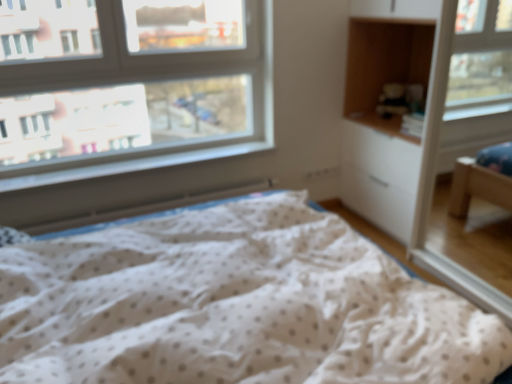
Measure the distance between point (x=2, y=320) and camera.

Point (x=2, y=320) and camera are 1.24 meters apart.

Locate an element on the screen. white plastic radiator at lower left is located at coordinates (141, 210).

Describe the element at coordinates (133, 82) in the screenshot. The image size is (512, 384). I see `clear glass window at upper left` at that location.

Describe the element at coordinates (132, 165) in the screenshot. The image size is (512, 384). I see `white plastic window sill at lower left` at that location.

The width and height of the screenshot is (512, 384). In order to click on wooden cabinet at upper right in this screenshot , I will do `click(384, 67)`.

Is white plastic radiator at lower left smaller than clear glass window at upper left?

Yes.

Considering the sizes of objects white plastic radiator at lower left and clear glass window at upper left in the image provided, who is thinner, white plastic radiator at lower left or clear glass window at upper left?

clear glass window at upper left is thinner.

Would you say white plastic radiator at lower left is a long distance from clear glass window at upper left?

They are positioned close to each other.

From a real-world perspective, which is physically above, white plastic radiator at lower left or clear glass window at upper left?

clear glass window at upper left, from a real-world perspective.

Can you confirm if wooden cabinet at upper right is taller than clear glass window at upper left?

Incorrect, the height of wooden cabinet at upper right is not larger of that of clear glass window at upper left.

What's the angular difference between wooden cabinet at upper right and clear glass window at upper left's facing directions?

The angle between the facing direction of wooden cabinet at upper right and the facing direction of clear glass window at upper left is 90.9 degrees.

This screenshot has width=512, height=384. I want to click on window that appears below the wooden cabinet at upper right (from the image's perspective), so click(133, 82).

Identify the location of window sill on the left of white plastic radiator at lower left. The width and height of the screenshot is (512, 384). (132, 165).

Do you think white plastic window sill at lower left is within white plastic radiator at lower left, or outside of it?

white plastic window sill at lower left is not inside white plastic radiator at lower left, it's outside.

Can you confirm if white plastic window sill at lower left is wider than white plastic radiator at lower left?

Yes, white plastic window sill at lower left is wider than white plastic radiator at lower left.

Consider the image. How many degrees apart are the facing directions of white plastic window sill at lower left and white plastic radiator at lower left?

The angular difference between white plastic window sill at lower left and white plastic radiator at lower left is 0.729 degrees.

Is white dotted fabric at center positioned in front of wooden cabinet at upper right?

Yes.

Considering the sizes of objects white dotted fabric at center and wooden cabinet at upper right in the image provided, who is wider, white dotted fabric at center or wooden cabinet at upper right?

white dotted fabric at center is wider.

The width and height of the screenshot is (512, 384). I want to click on bed in front of the wooden cabinet at upper right, so click(234, 306).

Consider the image. Are white dotted fabric at center and wooden cabinet at upper right far apart?

Absolutely, white dotted fabric at center is distant from wooden cabinet at upper right.

Is white plastic radiator at lower left aimed at white plastic window sill at lower left?

No.

Does point (177, 198) lie in front of point (81, 172)?

No, (177, 198) is behind (81, 172).

Can you confirm if white plastic radiator at lower left is smaller than white plastic window sill at lower left?

Incorrect, white plastic radiator at lower left is not smaller in size than white plastic window sill at lower left.

Does clear glass window at upper left turn towards wooden cabinet at upper right?

No, clear glass window at upper left is not facing towards wooden cabinet at upper right.

Choose the correct answer: Is clear glass window at upper left inside wooden cabinet at upper right or outside it?

clear glass window at upper left lies outside wooden cabinet at upper right.

Between clear glass window at upper left and wooden cabinet at upper right, which one appears on the left side from the viewer's perspective?

From the viewer's perspective, clear glass window at upper left appears more on the left side.

Is clear glass window at upper left not near wooden cabinet at upper right?

They are positioned close to each other.

Is white plastic window sill at lower left inside or outside of wooden cabinet at upper right?

white plastic window sill at lower left exists outside the volume of wooden cabinet at upper right.

The width and height of the screenshot is (512, 384). I want to click on window sill on the left of wooden cabinet at upper right, so click(x=132, y=165).

Considering the relative sizes of white plastic window sill at lower left and wooden cabinet at upper right in the image provided, is white plastic window sill at lower left shorter than wooden cabinet at upper right?

Indeed, white plastic window sill at lower left has a lesser height compared to wooden cabinet at upper right.

Can you confirm if white plastic window sill at lower left is wider than wooden cabinet at upper right?

No, white plastic window sill at lower left is not wider than wooden cabinet at upper right.

Identify the location of window that appears on the left of white plastic radiator at lower left. (133, 82).

Identify the location of cabinet below the clear glass window at upper left (from a real-world perspective). This screenshot has height=384, width=512. (384, 67).

Estimate the real-world distances between objects in this image. Which object is further from clear glass window at upper left, wooden cabinet at upper right or white plastic radiator at lower left?

Among the two, wooden cabinet at upper right is located further to clear glass window at upper left.

Estimate the real-world distances between objects in this image. Which object is closer to white dotted fabric at center, wooden cabinet at upper right or white plastic radiator at lower left?

white plastic radiator at lower left is positioned closer to the anchor white dotted fabric at center.

Estimate the real-world distances between objects in this image. Which object is further from white plastic radiator at lower left, white dotted fabric at center or clear glass window at upper left?

Based on the image, white dotted fabric at center appears to be further to white plastic radiator at lower left.

When comparing their distances from clear glass window at upper left, does white dotted fabric at center or white plastic radiator at lower left seem closer?

white plastic radiator at lower left is closer to clear glass window at upper left.

Based on their spatial positions, is white plastic radiator at lower left or white plastic window sill at lower left closer to clear glass window at upper left?

white plastic window sill at lower left lies closer to clear glass window at upper left than the other object.

When comparing their distances from clear glass window at upper left, does white plastic window sill at lower left or white plastic radiator at lower left seem further?

Based on the image, white plastic radiator at lower left appears to be further to clear glass window at upper left.

Which object lies nearer to the anchor point white plastic radiator at lower left, wooden cabinet at upper right or white plastic window sill at lower left?

Based on the image, white plastic window sill at lower left appears to be nearer to white plastic radiator at lower left.

Looking at the image, which one is located further to white plastic window sill at lower left, clear glass window at upper left or white dotted fabric at center?

white dotted fabric at center lies further to white plastic window sill at lower left than the other object.

Locate an element on the screen. The image size is (512, 384). radiator between clear glass window at upper left and wooden cabinet at upper right is located at coordinates (141, 210).

Locate an element on the screen. window sill situated between clear glass window at upper left and wooden cabinet at upper right from left to right is located at coordinates (132, 165).

Find the location of a particular element. window located between white dotted fabric at center and white plastic radiator at lower left in the depth direction is located at coordinates (133, 82).

Locate an element on the screen. This screenshot has height=384, width=512. radiator situated between white plastic window sill at lower left and wooden cabinet at upper right from left to right is located at coordinates (141, 210).